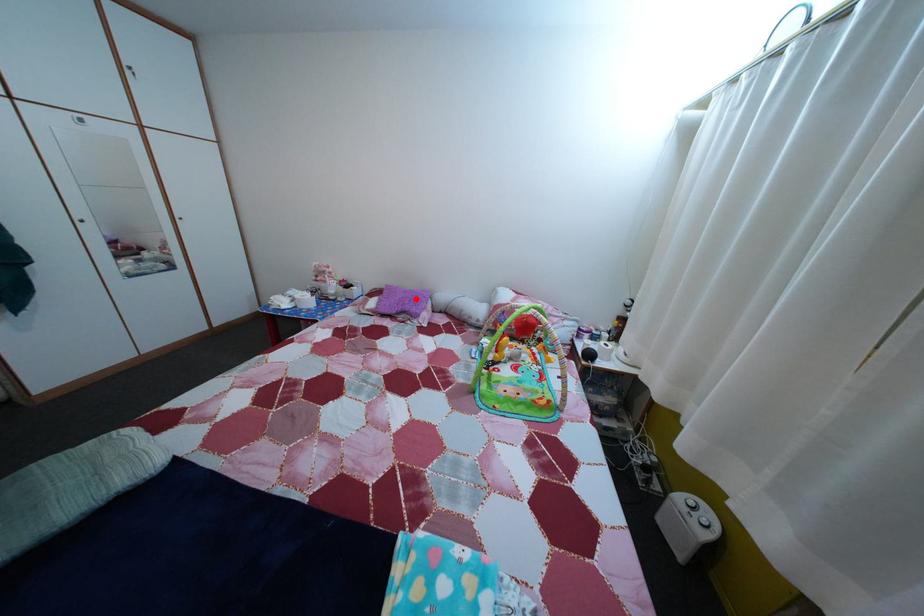
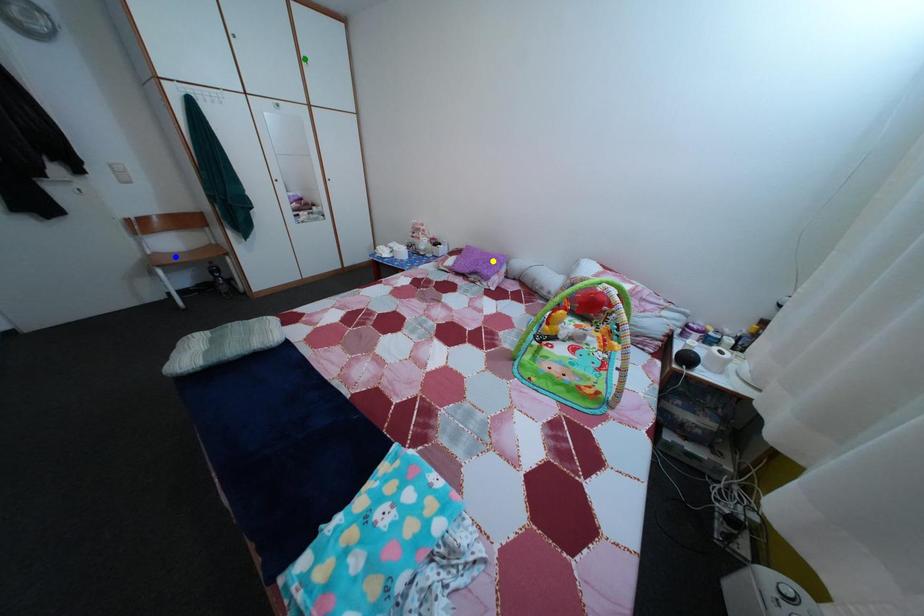
Question: I am providing you with two images of the same scene from different viewpoints. A red point is marked on the first image. You are given multiple points on the second image. Which spot in image 2 lines up with the point in image 1?

Choices:
 (A) blue point
 (B) yellow point
 (C) green point

Answer: (B)